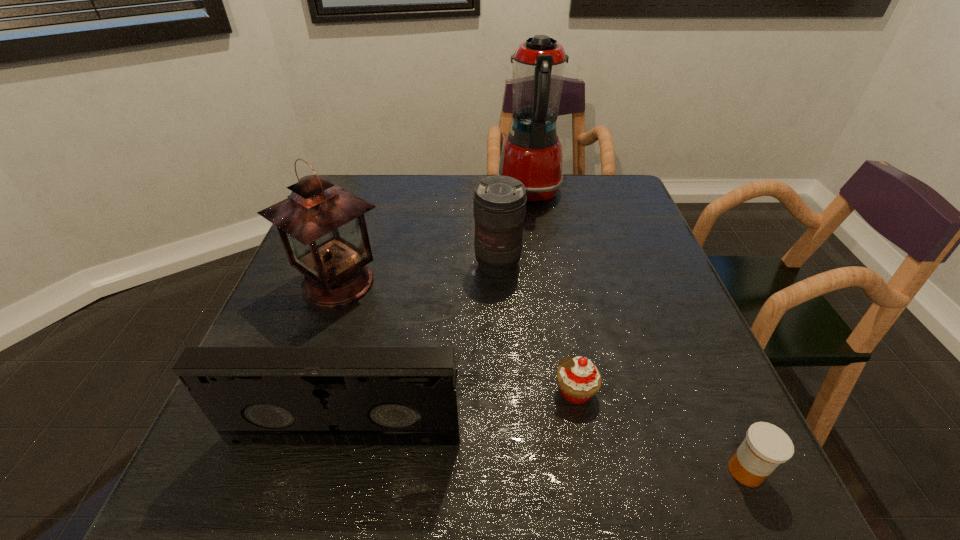
The image size is (960, 540). In order to click on vacant space that's between the oil lamp and the rightmost object in this screenshot , I will do `click(541, 377)`.

Identify the location of empty location between the telephoto lens and the second tallest object. The height and width of the screenshot is (540, 960). (418, 274).

What are the coordinates of `vacant space that is in between the food processor and the fourth farthest object` in the screenshot? It's located at (552, 293).

Where is `free space between the medicine and the farthest object`? The image size is (960, 540). free space between the medicine and the farthest object is located at coordinates (637, 332).

This screenshot has width=960, height=540. I want to click on free space between the farthest object and the cupcake, so click(x=552, y=293).

This screenshot has height=540, width=960. I want to click on vacant region between the rightmost object and the cupcake, so click(660, 431).

Point out which object is positioned as the second nearest to the videotape. Please provide its 2D coordinates. Your answer should be formatted as a tuple, i.e. [(x, y)], where the tuple contains the x and y coordinates of a point satisfying the conditions above.

[(322, 226)]

Where is `object that is the fourth nearest to the fifth shortest object`? This screenshot has width=960, height=540. object that is the fourth nearest to the fifth shortest object is located at coordinates (579, 379).

Where is `free region that satisfies the following two spatial constraints: 1. on the side of the telephoto lens where the control switches are located; 2. on the right side of the cupcake`? The width and height of the screenshot is (960, 540). free region that satisfies the following two spatial constraints: 1. on the side of the telephoto lens where the control switches are located; 2. on the right side of the cupcake is located at coordinates (504, 392).

Where is `vacant position in the image that satisfies the following two spatial constraints: 1. on the controls of the farthest object; 2. on the front side of the second nearest object`? vacant position in the image that satisfies the following two spatial constraints: 1. on the controls of the farthest object; 2. on the front side of the second nearest object is located at coordinates (566, 434).